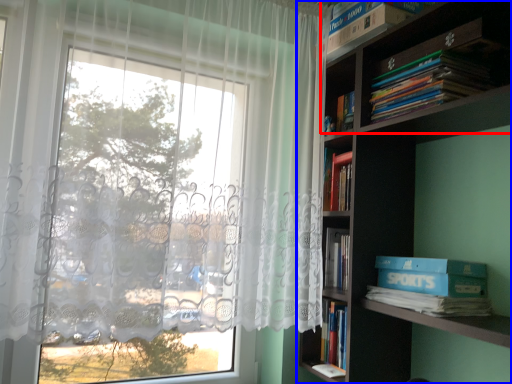
Question: Among these objects, which one is farthest to the camera, shelf (highlighted by a red box) or bookcase (highlighted by a blue box)?

Choices:
 (A) shelf
 (B) bookcase

Answer: (A)